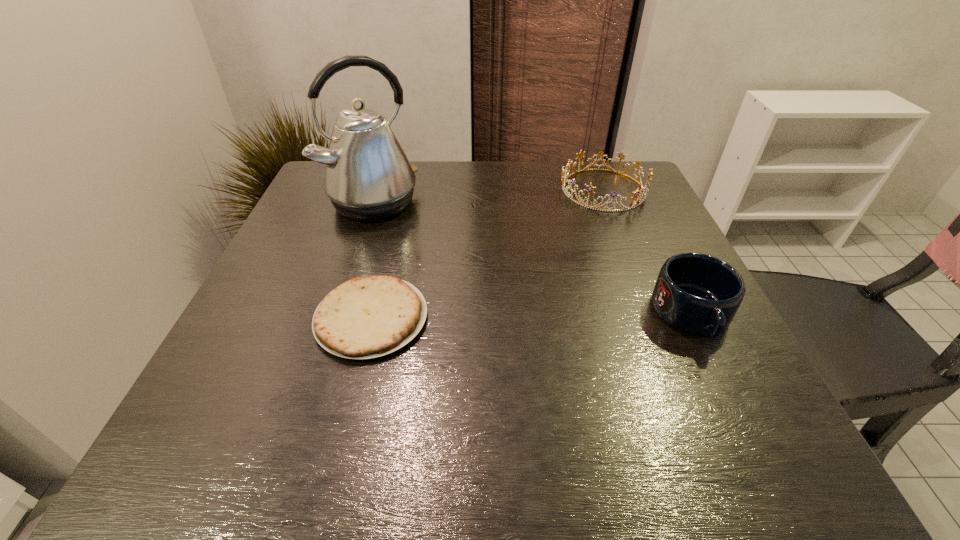
The height and width of the screenshot is (540, 960). What are the coordinates of `the shortest object` in the screenshot? It's located at (367, 317).

Find the location of a particular element. mug is located at coordinates (697, 293).

Image resolution: width=960 pixels, height=540 pixels. I want to click on tiara, so click(633, 204).

The height and width of the screenshot is (540, 960). What are the coordinates of `the tallest object` in the screenshot? It's located at pos(368,177).

Where is `free space located 0.350m on the right of the shortest object`? The height and width of the screenshot is (540, 960). free space located 0.350m on the right of the shortest object is located at coordinates (612, 318).

This screenshot has width=960, height=540. I want to click on free space located with the handle on the side of the mug, so click(x=724, y=380).

Locate an element on the screen. Image resolution: width=960 pixels, height=540 pixels. vacant region located on the front-facing side of the tiara is located at coordinates click(x=576, y=221).

The width and height of the screenshot is (960, 540). What are the coordinates of `vacant space located on the front-facing side of the tiara` in the screenshot? It's located at (517, 289).

This screenshot has width=960, height=540. Identify the location of free spot located on the front-facing side of the tiara. (517, 289).

This screenshot has width=960, height=540. In order to click on vacant region located 0.280m from the spout of the kettle in this screenshot , I will do `click(465, 283)`.